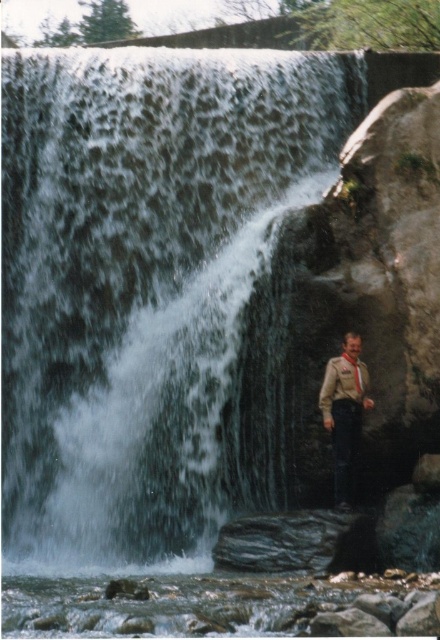
You are a photographer trying to capture the waterfall scene. You notice the brown leather jacket at lower right and the matte brown tie at right in your frame. Which object should you adjust your camera to focus on first if you want to ensure both are in focus, considering their positions?

The brown leather jacket at lower right should be focused on first because it is located below the matte brown tie at right, meaning it is closer to the camera. Adjusting focus starting from the closer object ensures both will be in focus when using proper depth of field.

You are a photographer planning to capture the waterfall scene. You want to ensure that both the clear water at center and the brown leather jacket at lower right are clearly visible in your shot. Given their sizes, which object should you focus on first to ensure proper framing?

The clear water at center is larger in size than the brown leather jacket at lower right, so you should focus on the clear water at center first to ensure it fits properly in the frame before adjusting for the smaller jacket.